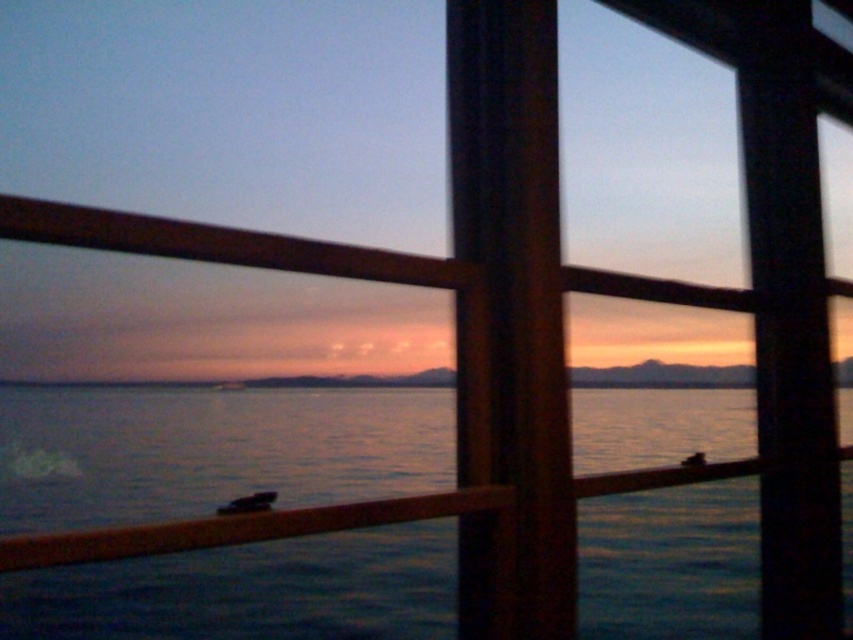
Can you confirm if blue water at center is taller than smooth water at center?

Correct, blue water at center is much taller as smooth water at center.

Is blue water at center shorter than smooth water at center?

In fact, blue water at center may be taller than smooth water at center.

Is point (258, 630) positioned in front of point (727, 369)?

That is True.

In order to click on blue water at center in this screenshot , I will do `click(215, 451)`.